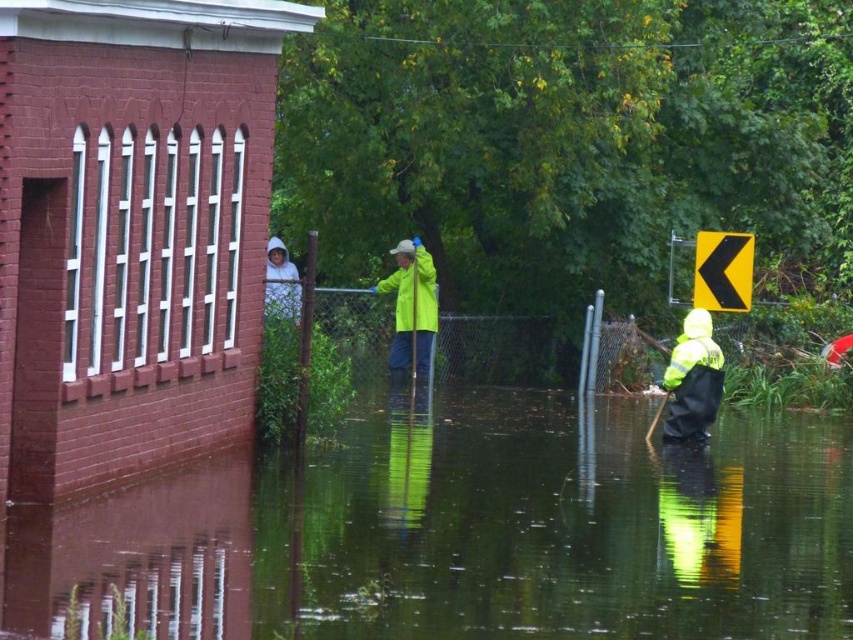
Does reflective yellow jacket at lower right have a greater height compared to neon yellow raincoat at center?

No.

From the picture: Does reflective yellow jacket at lower right have a smaller size compared to neon yellow raincoat at center?

No, reflective yellow jacket at lower right is not smaller than neon yellow raincoat at center.

Is point (651, 522) in front of point (401, 289)?

Yes.

I want to click on reflective yellow jacket at lower right, so click(468, 532).

Locate an element on the screen. reflective yellow raincoat at center is located at coordinates (692, 380).

Who is more forward, (685, 358) or (679, 356)?

Point (685, 358) is in front.

This screenshot has height=640, width=853. I want to click on reflective yellow raincoat at center, so click(x=692, y=380).

Which is behind, point (426, 304) or point (296, 316)?

The point (426, 304) is behind.

Can you confirm if neon yellow raincoat at center is bigger than white hooded sweatshirt at upper center?

No, neon yellow raincoat at center is not bigger than white hooded sweatshirt at upper center.

Does point (418, 275) lie behind point (280, 264)?

No, it is not.

This screenshot has width=853, height=640. What are the coordinates of `neon yellow raincoat at center` in the screenshot? It's located at (410, 307).